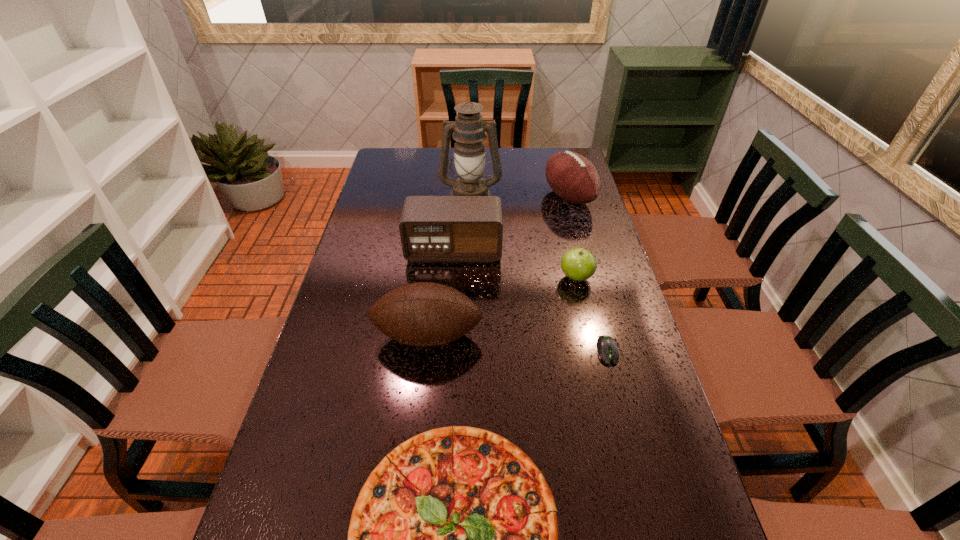
Locate an element on the screen. Image resolution: width=960 pixels, height=540 pixels. the tallest object is located at coordinates click(469, 128).

Locate an element on the screen. the right football is located at coordinates (572, 177).

Locate an element on the screen. The height and width of the screenshot is (540, 960). the nearer football is located at coordinates (424, 314).

Where is `the fifth nearest object`? This screenshot has height=540, width=960. the fifth nearest object is located at coordinates (432, 228).

Locate an element on the screen. The width and height of the screenshot is (960, 540). apple is located at coordinates (578, 264).

Where is `the third shortest object`? The height and width of the screenshot is (540, 960). the third shortest object is located at coordinates (578, 264).

This screenshot has width=960, height=540. Find the location of `computer mouse`. computer mouse is located at coordinates (606, 346).

You are a GUI agent. You are given a task and a screenshot of the screen. Output one action in this format:
    pyautogui.click(x=<x>, y=<y>)
    Task: Click on the vacant space located 0.250m on the back of the tallest object
    The image size is (960, 540).
    Given the screenshot: What is the action you would take?
    pyautogui.click(x=471, y=151)

Locate an element on the screen. The image size is (960, 540). free point located on the back of the farther football is located at coordinates (562, 171).

Where is `vacant space located on the laces of the nearer football`? vacant space located on the laces of the nearer football is located at coordinates (407, 524).